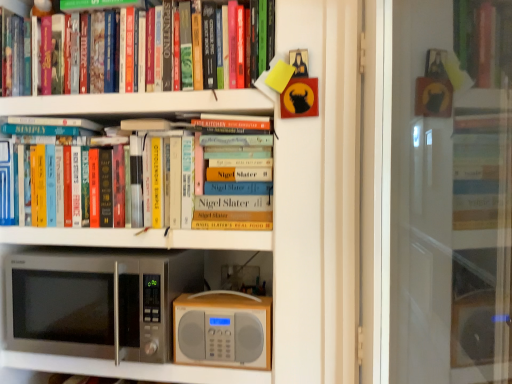
Question: Considering the relative sizes of hardcover books at upper left, the first book viewed from the top, and satin silver microwave at lower left in the image provided, is hardcover books at upper left, the first book viewed from the top, smaller than satin silver microwave at lower left?

Choices:
 (A) yes
 (B) no

Answer: (A)

Question: Is satin silver microwave at lower left at the back of hardcover books at upper left, the first book viewed from the top?

Choices:
 (A) no
 (B) yes

Answer: (A)

Question: Can you confirm if hardcover books at upper left, the first book viewed from the top, is positioned to the left of satin silver microwave at lower left?

Choices:
 (A) no
 (B) yes

Answer: (A)

Question: Is hardcover books at upper left, arranged as the 2th book when ordered from the bottom, taller than satin silver microwave at lower left?

Choices:
 (A) yes
 (B) no

Answer: (A)

Question: Is hardcover books at upper left, the first book viewed from the top, outside satin silver microwave at lower left?

Choices:
 (A) yes
 (B) no

Answer: (A)

Question: Would you say transparent glass screen door at upper center is to the left or to the right of wooden radio at center in the picture?

Choices:
 (A) left
 (B) right

Answer: (B)

Question: Considering the positions of transparent glass screen door at upper center and wooden radio at center in the image, is transparent glass screen door at upper center wider or thinner than wooden radio at center?

Choices:
 (A) thin
 (B) wide

Answer: (B)

Question: From their relative heights in the image, would you say transparent glass screen door at upper center is taller or shorter than wooden radio at center?

Choices:
 (A) tall
 (B) short

Answer: (A)

Question: From a real-world perspective, is transparent glass screen door at upper center positioned above or below wooden radio at center?

Choices:
 (A) below
 (B) above

Answer: (B)

Question: In terms of height, does wooden radio at center look taller or shorter compared to hardcover books at upper left, arranged as the 2th book when ordered from the bottom?

Choices:
 (A) short
 (B) tall

Answer: (A)

Question: Looking at the image, does wooden radio at center seem bigger or smaller compared to hardcover books at upper left, arranged as the 2th book when ordered from the bottom?

Choices:
 (A) small
 (B) big

Answer: (A)

Question: Would you say wooden radio at center is inside or outside hardcover books at upper left, the first book viewed from the top?

Choices:
 (A) outside
 (B) inside

Answer: (A)

Question: Considering the positions of wooden radio at center and hardcover books at upper left, the first book viewed from the top, in the image, is wooden radio at center wider or thinner than hardcover books at upper left, the first book viewed from the top,?

Choices:
 (A) thin
 (B) wide

Answer: (A)

Question: Does point (260, 117) appear closer or farther from the camera than point (495, 162)?

Choices:
 (A) closer
 (B) farther

Answer: (A)

Question: From a real-world perspective, is hardcover books at center, placed as the 2th book when sorted from top to bottom, positioned above or below transparent glass screen door at upper center?

Choices:
 (A) below
 (B) above

Answer: (B)